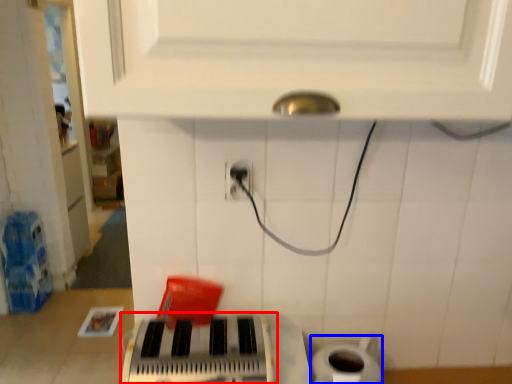
Question: Which object appears farthest to the camera in this image, musical keyboard (highlighted by a red box) or toilet paper (highlighted by a blue box)?

Choices:
 (A) musical keyboard
 (B) toilet paper

Answer: (B)